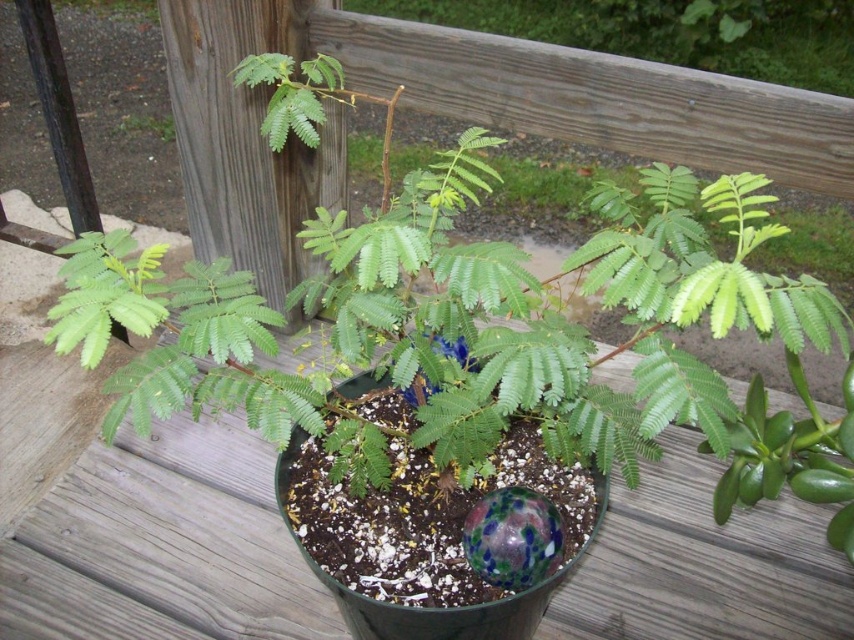
Question: Can you confirm if green matte plant at upper center is bigger than green leafy plant at upper left?

Choices:
 (A) no
 (B) yes

Answer: (B)

Question: Is green matte plant at upper center below green leafy plant at upper left?

Choices:
 (A) yes
 (B) no

Answer: (B)

Question: Which point is closer to the camera taking this photo?

Choices:
 (A) (495, 6)
 (B) (132, 113)

Answer: (B)

Question: Which point is closer to the camera?

Choices:
 (A) (151, 124)
 (B) (516, 20)

Answer: (A)

Question: In this image, where is green matte plant at upper center located relative to green leafy plant at upper left?

Choices:
 (A) right
 (B) left

Answer: (A)